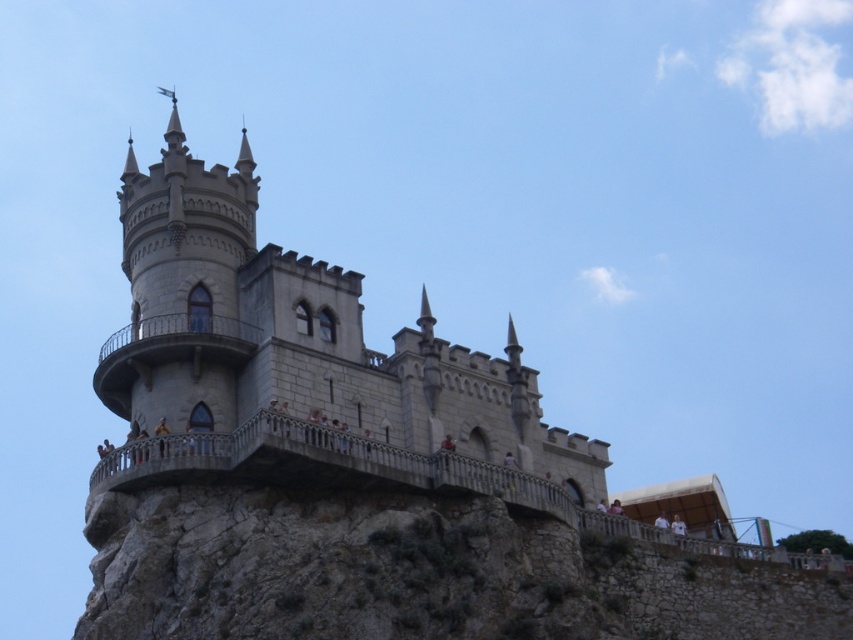
You are a photographer planning to capture the gray stone castle at center and the gray stone hill at lower left in a single shot. Considering their sizes, which object will appear larger in the photo?

The gray stone castle at center is much taller than the gray stone hill at lower left, so it will appear larger in the photo.

You are planning to take a photo of the gray stone castle at center and the gray stone hill at lower left. Which object will appear narrower in your photo?

The gray stone castle at center will appear narrower in the photo because its width is less than that of the gray stone hill at lower left.

You are standing at the base of the castle structure and looking up at the two points marked on the image. Which point, point (x=489, y=426) or point (x=555, y=552), is closer to your viewpoint?

Point (x=489, y=426) is further to the camera than point (x=555, y=552), so the point closer to your viewpoint is point (x=555, y=552).